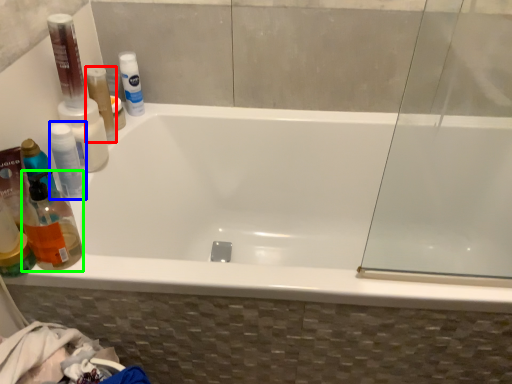
Question: Based on their relative distances, which object is farther from mouthwash (highlighted by a red box)? Choose from mouthwash (highlighted by a blue box) and cleaning product (highlighted by a green box).

Choices:
 (A) mouthwash
 (B) cleaning product

Answer: (B)